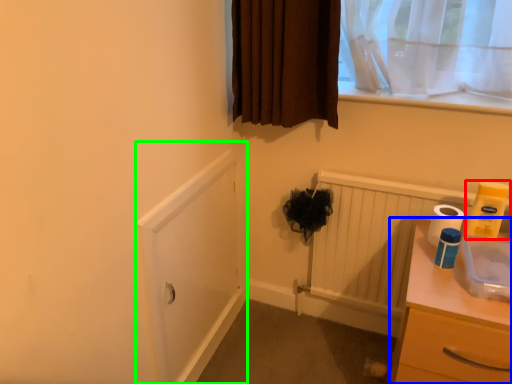
Question: Estimate the real-world distances between objects in this image. Which object is closer to toilet paper (highlighted by a red box), chest of drawers (highlighted by a blue box) or screen door (highlighted by a green box)?

Choices:
 (A) chest of drawers
 (B) screen door

Answer: (A)